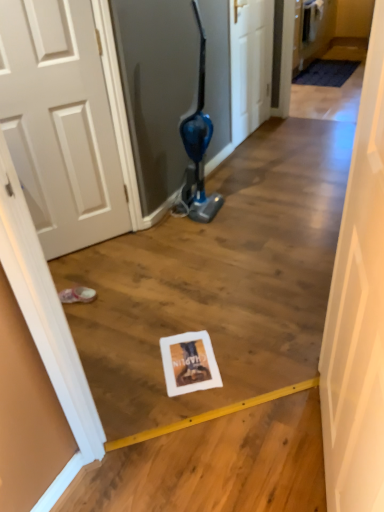
Question: From a real-world perspective, is white matte door at center, the second door from the back, on top of white wood door at center, the second door when ordered from bottom to top?

Choices:
 (A) yes
 (B) no

Answer: (A)

Question: Considering the relative sizes of white matte door at center, which is the second door from top to bottom, and white wood door at center, which appears as the 2th door when viewed from the front, in the image provided, is white matte door at center, which is the second door from top to bottom, bigger than white wood door at center, which appears as the 2th door when viewed from the front,?

Choices:
 (A) no
 (B) yes

Answer: (B)

Question: Is white matte door at center, which ranks as the first door in front-to-back order, positioned far away from white wood door at center, placed as the first door when sorted from back to front?

Choices:
 (A) no
 (B) yes

Answer: (B)

Question: Is white matte door at center, the second door from the back, outside of white wood door at center, placed as the first door when sorted from back to front?

Choices:
 (A) no
 (B) yes

Answer: (B)

Question: Is the position of white matte door at center, which is the second door from top to bottom, less distant than that of white wood door at center, the second door when ordered from bottom to top?

Choices:
 (A) yes
 (B) no

Answer: (A)

Question: Choose the correct answer: Is white matte door at center, which is the second door from top to bottom, inside pink fabric footwear at lower left or outside it?

Choices:
 (A) inside
 (B) outside

Answer: (B)

Question: Looking at their shapes, would you say white matte door at center, the first door in the bottom-to-top sequence, is wider or thinner than pink fabric footwear at lower left?

Choices:
 (A) thin
 (B) wide

Answer: (A)

Question: Looking at the image, does white matte door at center, which is the second door from top to bottom, seem bigger or smaller compared to pink fabric footwear at lower left?

Choices:
 (A) small
 (B) big

Answer: (B)

Question: From a real-world perspective, is white matte door at center, which is the second door from top to bottom, above or below pink fabric footwear at lower left?

Choices:
 (A) below
 (B) above

Answer: (B)

Question: Is point (251, 45) closer or farther from the camera than point (91, 301)?

Choices:
 (A) farther
 (B) closer

Answer: (A)

Question: Is white wood door at center, the second door when ordered from bottom to top, inside or outside of pink fabric footwear at lower left?

Choices:
 (A) inside
 (B) outside

Answer: (B)

Question: Relative to pink fabric footwear at lower left, is white wood door at center, which appears as the 2th door when viewed from the front, in front or behind?

Choices:
 (A) behind
 (B) front

Answer: (A)

Question: From a real-world perspective, is white wood door at center, which appears as the 2th door when viewed from the front, above or below pink fabric footwear at lower left?

Choices:
 (A) above
 (B) below

Answer: (A)

Question: From a real-world perspective, is white matte door at center, the second door from the back, above or below white wood door at center, acting as the 1th door starting from the top?

Choices:
 (A) above
 (B) below

Answer: (A)

Question: Visually, is white matte door at center, which ranks as the first door in front-to-back order, positioned to the left or to the right of white wood door at center, placed as the first door when sorted from back to front?

Choices:
 (A) right
 (B) left

Answer: (B)